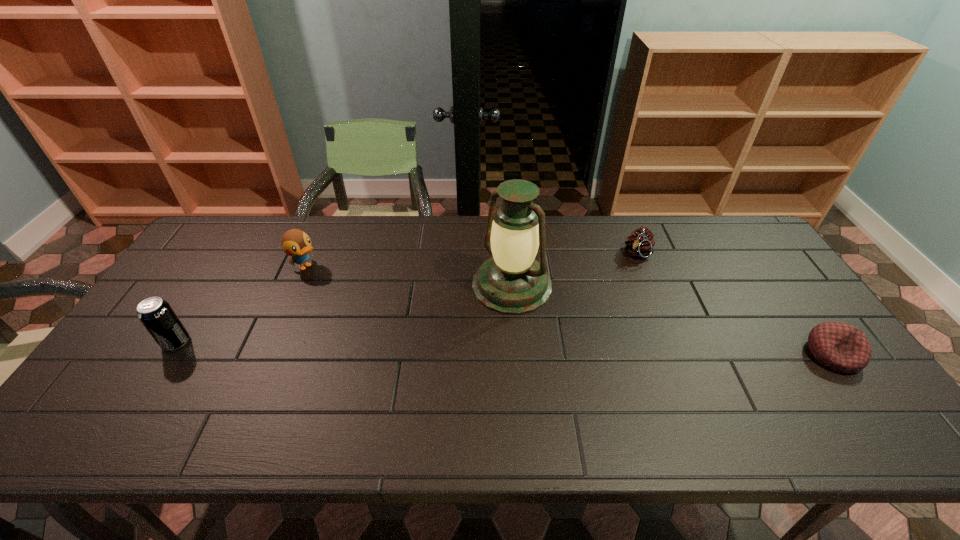
In the image, there is a desktop. Where is `vacant space at the near left corner`? This screenshot has height=540, width=960. vacant space at the near left corner is located at coordinates (147, 382).

Locate an element on the screen. This screenshot has width=960, height=540. free point at the far right corner is located at coordinates (742, 251).

At what (x,y) coordinates should I click in order to perform the action: click on free space between the second object from left to right and the rightmost object. Please return your answer as a coordinate pair (x, y). This screenshot has height=540, width=960. Looking at the image, I should click on (569, 310).

Where is `free space that is in between the fourth object from left to right and the leftmost object`? This screenshot has width=960, height=540. free space that is in between the fourth object from left to right and the leftmost object is located at coordinates (407, 298).

You are a GUI agent. You are given a task and a screenshot of the screen. Output one action in this format:
    pyautogui.click(x=<x>, y=<y>)
    Task: Click on the free space between the beanbag and the leftmost object
    This screenshot has height=540, width=960.
    Given the screenshot: What is the action you would take?
    [x=504, y=348]

I want to click on free space between the fourth object from left to right and the soda can, so click(407, 298).

You are a GUI agent. You are given a task and a screenshot of the screen. Output one action in this format:
    pyautogui.click(x=<x>, y=<y>)
    Task: Click on the vacant area that lies between the tallest object and the second object from right to left
    The width and height of the screenshot is (960, 540).
    Given the screenshot: What is the action you would take?
    pyautogui.click(x=575, y=269)

You are a GUI agent. You are given a task and a screenshot of the screen. Output one action in this format:
    pyautogui.click(x=<x>, y=<y>)
    Task: Click on the vacant space that's between the third object from left to right and the duck
    The width and height of the screenshot is (960, 540).
    Given the screenshot: What is the action you would take?
    pyautogui.click(x=409, y=276)

The image size is (960, 540). I want to click on unoccupied area between the pinecone and the soda can, so click(x=407, y=298).

Identify the location of empty space between the rightmost object and the second object from left to right. (569, 310).